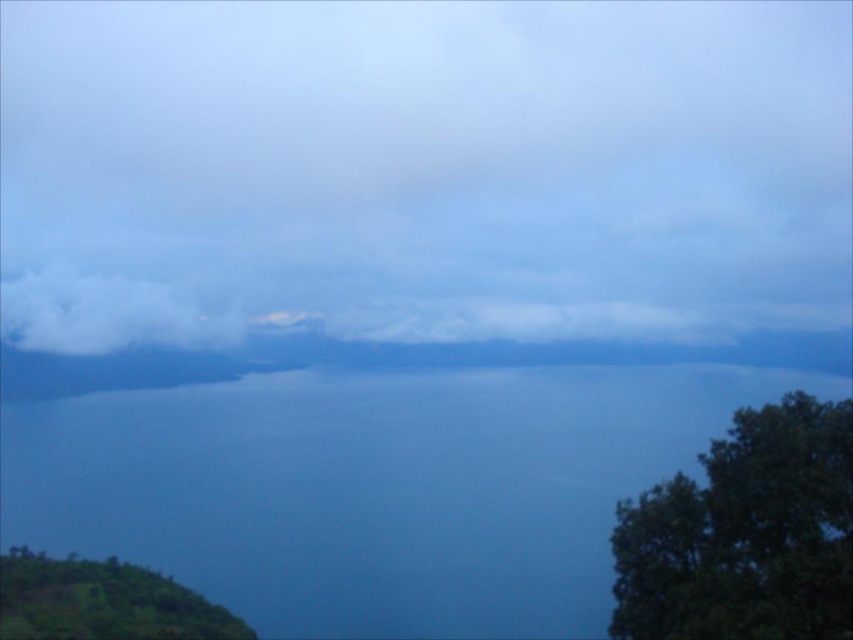
Question: Is blue water at center further to camera compared to white fluffy cloud at left?

Choices:
 (A) yes
 (B) no

Answer: (A)

Question: Among these objects, which one is farthest from the camera?

Choices:
 (A) blue water at center
 (B) green leafy hillside at lower left
 (C) dark green leafy tree at lower right

Answer: (A)

Question: Among these points, which one is farthest from the camera?

Choices:
 (A) (234, 339)
 (B) (664, 616)
 (C) (196, 442)

Answer: (A)

Question: Which point is farther to the camera?

Choices:
 (A) green leafy hillside at lower left
 (B) dark green leafy tree at lower right
 (C) white fluffy cloud at left

Answer: (C)

Question: Is blue water at center wider than dark green leafy tree at lower right?

Choices:
 (A) no
 (B) yes

Answer: (A)

Question: Is dark green leafy tree at lower right bigger than white fluffy cloud at left?

Choices:
 (A) yes
 (B) no

Answer: (A)